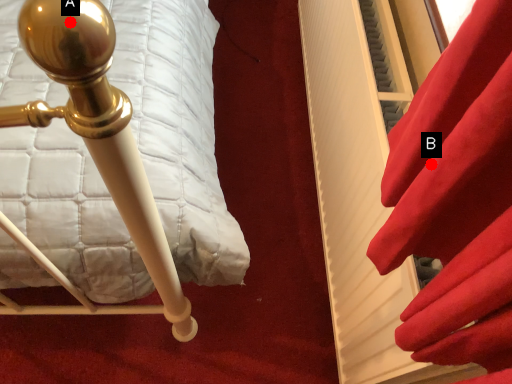
Question: Two points are circled on the image, labeled by A and B beside each circle. Which point appears closest to the camera in this image?

Choices:
 (A) A is closer
 (B) B is closer

Answer: (A)